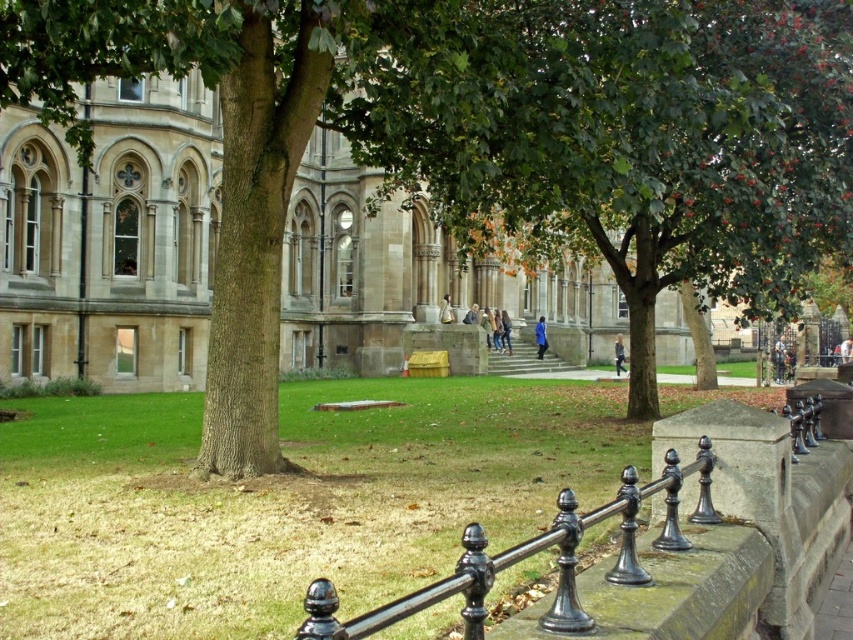
Question: Which of the following is the farthest from the observer?

Choices:
 (A) (x=461, y=586)
 (B) (x=694, y=38)

Answer: (B)

Question: Is green leafy tree at center thinner than black polished metal rail at lower center?

Choices:
 (A) no
 (B) yes

Answer: (A)

Question: Can you confirm if green leafy tree at center is wider than black polished metal rail at lower center?

Choices:
 (A) no
 (B) yes

Answer: (B)

Question: Which point is closer to the camera?

Choices:
 (A) (613, 93)
 (B) (305, 596)

Answer: (B)

Question: Can you confirm if green leafy tree at center is thinner than black polished metal rail at lower center?

Choices:
 (A) no
 (B) yes

Answer: (A)